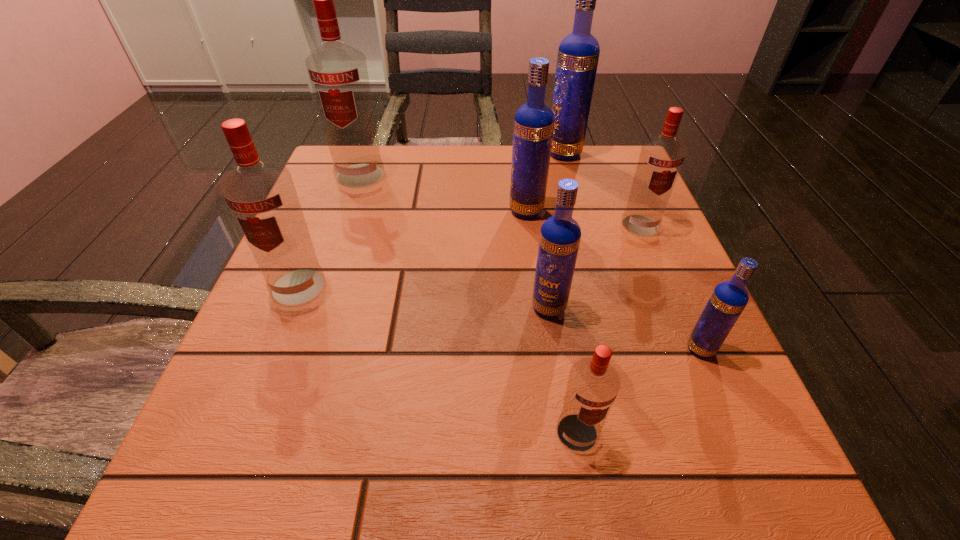
This screenshot has height=540, width=960. In order to click on the closest object to the third biggest red vodka in this screenshot , I will do `click(533, 128)`.

This screenshot has height=540, width=960. In order to click on vodka that is the second nearest to the nearest blue vodka in this screenshot , I will do `click(593, 384)`.

Where is `vodka object that ranks as the seventh closest to the farthest red vodka`? The width and height of the screenshot is (960, 540). vodka object that ranks as the seventh closest to the farthest red vodka is located at coordinates (729, 298).

Locate which blue vodka is the third closest to the third biggest red vodka. Please provide its 2D coordinates. Your answer should be formatted as a tuple, i.e. [(x, y)], where the tuple contains the x and y coordinates of a point satisfying the conditions above.

[(560, 235)]

This screenshot has width=960, height=540. I want to click on blue vodka that is the third closest to the second farthest blue vodka, so tap(729, 298).

Locate which red vodka ranks second in proximity to the second nearest blue vodka. Please provide its 2D coordinates. Your answer should be formatted as a tuple, i.e. [(x, y)], where the tuple contains the x and y coordinates of a point satisfying the conditions above.

[(661, 157)]

Point out which red vodka is positioned as the second nearest to the seventh farthest object. Please provide its 2D coordinates. Your answer should be formatted as a tuple, i.e. [(x, y)], where the tuple contains the x and y coordinates of a point satisfying the conditions above.

[(661, 157)]

Image resolution: width=960 pixels, height=540 pixels. Identify the location of free region that satisfies the following two spatial constraints: 1. on the front label of the second smallest blue vodka; 2. on the right side of the second farthest vodka. (314, 307).